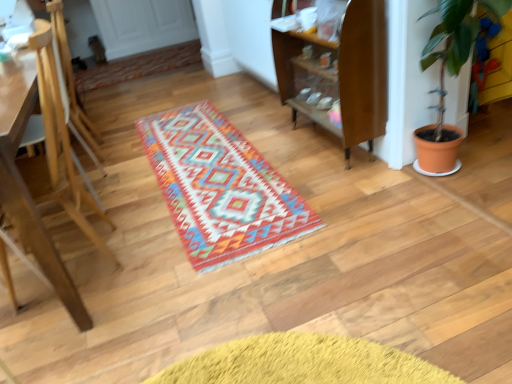
Question: Does wooden armchair at left have a greater width compared to light brown wooden easel at left?

Choices:
 (A) no
 (B) yes

Answer: (A)

Question: From a real-world perspective, is wooden armchair at left positioned over light brown wooden easel at left based on gravity?

Choices:
 (A) no
 (B) yes

Answer: (B)

Question: Is wooden armchair at left taller than light brown wooden easel at left?

Choices:
 (A) no
 (B) yes

Answer: (B)

Question: Is wooden armchair at left in front of light brown wooden easel at left?

Choices:
 (A) no
 (B) yes

Answer: (A)

Question: Would you say wooden armchair at left contains light brown wooden easel at left?

Choices:
 (A) no
 (B) yes

Answer: (A)

Question: From a real-world perspective, is wooden armchair at left positioned above or below wooden shelf at center?

Choices:
 (A) below
 (B) above

Answer: (B)

Question: In terms of size, does wooden armchair at left appear bigger or smaller than wooden shelf at center?

Choices:
 (A) big
 (B) small

Answer: (A)

Question: Relative to wooden shelf at center, is wooden armchair at left in front or behind?

Choices:
 (A) front
 (B) behind

Answer: (B)

Question: Is point (76, 104) closer or farther from the camera than point (329, 44)?

Choices:
 (A) farther
 (B) closer

Answer: (A)

Question: From the image's perspective, is wooden armchair at left positioned above or below light brown wooden easel at left?

Choices:
 (A) below
 (B) above

Answer: (B)

Question: Based on their positions, is wooden armchair at left located to the left or right of light brown wooden easel at left?

Choices:
 (A) right
 (B) left

Answer: (A)

Question: Does point (73, 132) appear closer or farther from the camera than point (48, 170)?

Choices:
 (A) closer
 (B) farther

Answer: (B)

Question: Looking at their shapes, would you say wooden armchair at left is wider or thinner than light brown wooden easel at left?

Choices:
 (A) thin
 (B) wide

Answer: (A)

Question: From a real-world perspective, is terracotta pot at right positioned above or below multicolored woven rug at upper center?

Choices:
 (A) below
 (B) above

Answer: (B)

Question: In terms of size, does terracotta pot at right appear bigger or smaller than multicolored woven rug at upper center?

Choices:
 (A) small
 (B) big

Answer: (A)